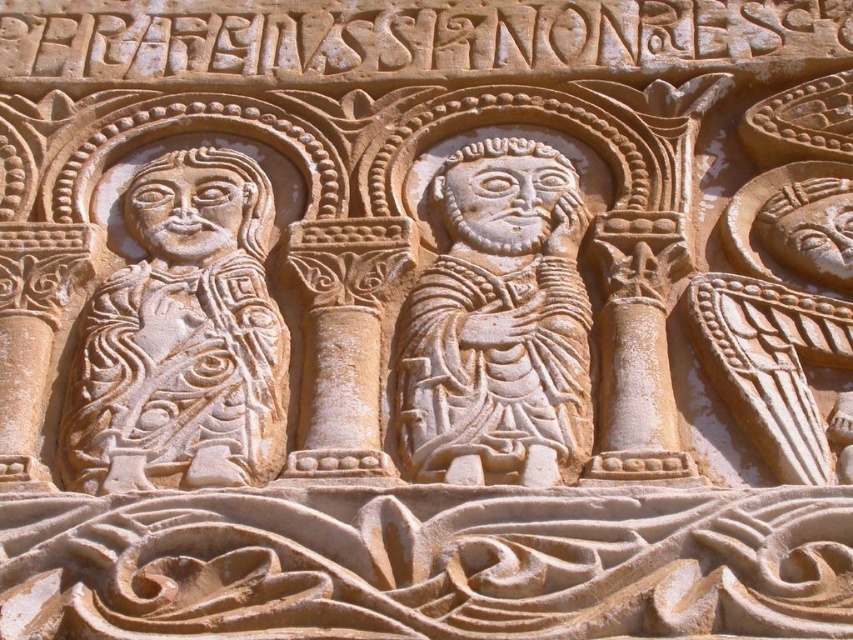
You are an art conservator examining the stone relief. You need to determine if the light beige stone figure at left can be moved to the right without overlapping the white stone figure at center. Based on their widths, can this be done?

The light beige stone figure at left might be wider than the white stone figure at center, so it is uncertain if moving it to the right would cause overlap. Further measurement is needed.

You are an art conservator examining the stone relief. You need to clean the light beige stone figure at left and the white stone figure at center. Which figure should you clean first if you want to start with the one closer to you?

The light beige stone figure at left is closer to the viewer than the white stone figure at center, so you should clean the light beige stone figure at left first.

You are an architect examining the stone relief. You notice a specific point at coordinates (183, 339). Which figure does this point belong to?

The point at coordinates (183, 339) is located on the light beige stone figure at left.